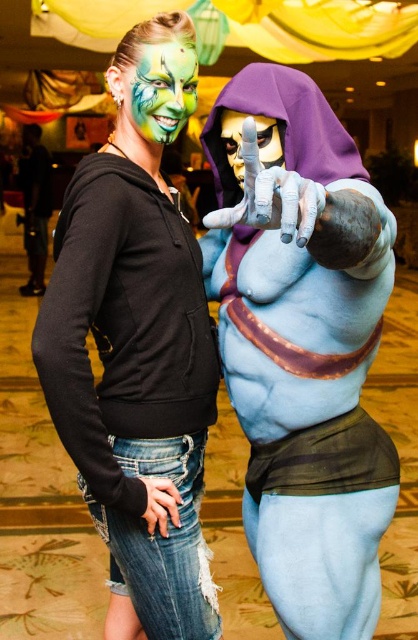
Question: Based on their relative distances, which object is nearer to the black matte hoodie at center?

Choices:
 (A) gold metallic mask at center
 (B) green matte face paint at upper center
 (C) smooth purple hood at upper right

Answer: (C)

Question: Does smooth purple hood at upper right appear on the left side of black matte hoodie at center?

Choices:
 (A) no
 (B) yes

Answer: (A)

Question: Is green matte face paint at upper center above gold metallic mask at center?

Choices:
 (A) no
 (B) yes

Answer: (B)

Question: Is smooth purple hood at upper right wider than green matte face paint at upper center?

Choices:
 (A) yes
 (B) no

Answer: (A)

Question: Which point is farther from the camera taking this photo?

Choices:
 (A) (237, 147)
 (B) (163, 49)
 (C) (280, 97)

Answer: (A)

Question: Among these points, which one is farthest from the camera?

Choices:
 (A) (143, 77)
 (B) (282, 289)

Answer: (B)